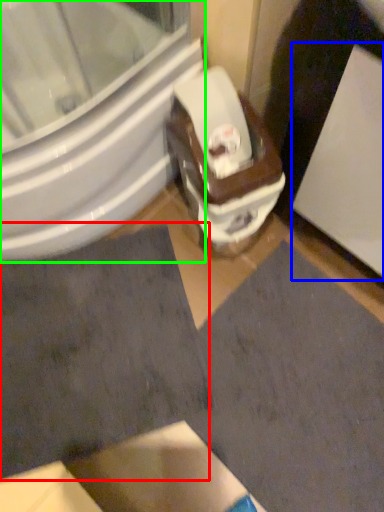
Question: Which object is positioned closest to square (highlighted by a red box)? Select from screen door (highlighted by a blue box) and bidet (highlighted by a green box).

Choices:
 (A) screen door
 (B) bidet

Answer: (B)